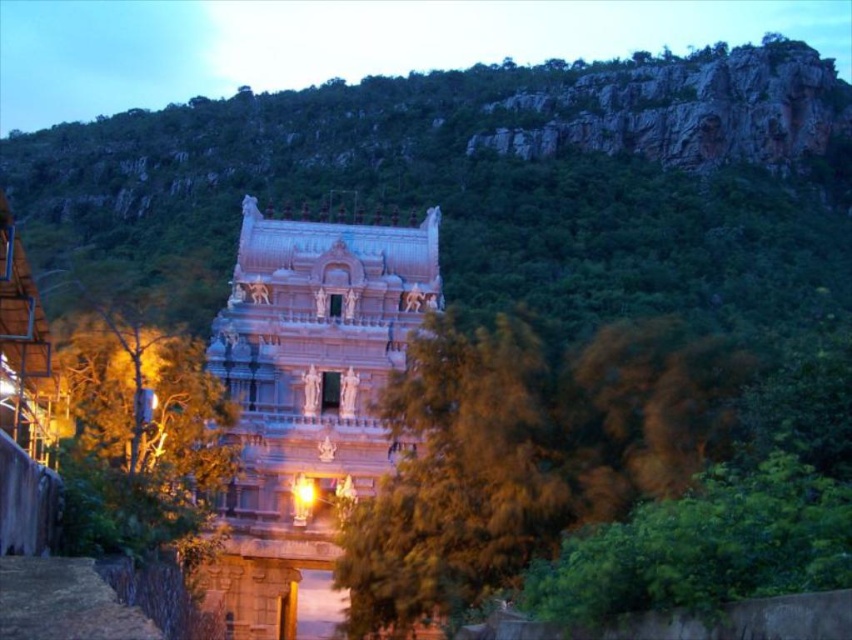
From the picture: Who is shorter, white marble temple at center or green leafy tree at left?

With less height is green leafy tree at left.

Which is more to the left, white marble temple at center or green leafy tree at left?

green leafy tree at left

Looking at this image, who is more forward, (315, 548) or (159, 524)?

Point (159, 524)

At what (x,y) coordinates should I click in order to perform the action: click on white marble temple at center. Please return your answer as a coordinate pair (x, y). The image size is (852, 640). Looking at the image, I should click on (306, 396).

Between green rocky hillside at upper center and green leafy tree at left, which one appears on the left side from the viewer's perspective?

green leafy tree at left is more to the left.

Who is more distant from viewer, (606, 33) or (177, 524)?

The point (606, 33) is more distant.

Locate an element on the screen. This screenshot has height=640, width=852. green rocky hillside at upper center is located at coordinates (344, 42).

Is green leafy tree at center below white marble temple at center?

Indeed, green leafy tree at center is positioned under white marble temple at center.

Who is higher up, green leafy tree at center or white marble temple at center?

white marble temple at center is higher up.

Locate an element on the screen. The image size is (852, 640). green leafy tree at center is located at coordinates (527, 452).